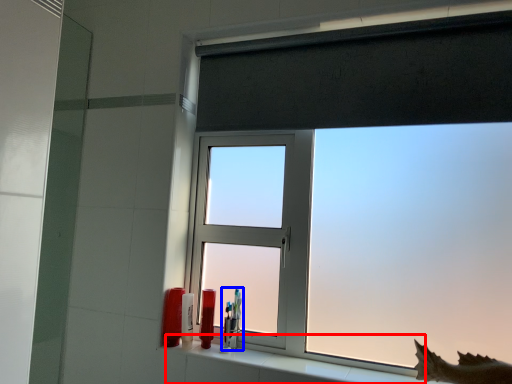
Question: Among these objects, which one is nearest to the camera, window sill (highlighted by a red box) or toiletry (highlighted by a blue box)?

Choices:
 (A) window sill
 (B) toiletry

Answer: (A)